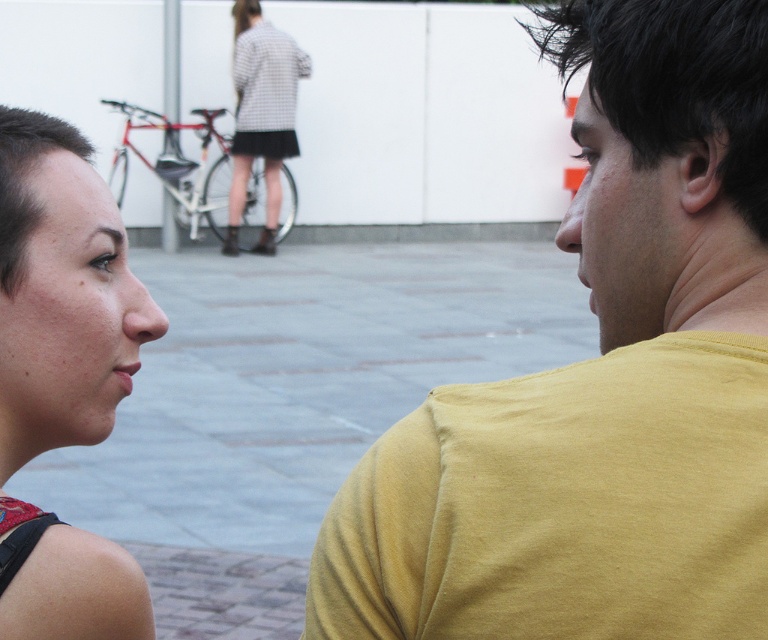
Which is more to the left, yellow cotton t-shirt at right or checkered fabric dress at upper center?

From the viewer's perspective, checkered fabric dress at upper center appears more on the left side.

Which is behind, point (608, 67) or point (263, 221)?

The point (263, 221) is behind.

Find the location of a particular element. This screenshot has height=640, width=768. yellow cotton t-shirt at right is located at coordinates (601, 380).

Is point (128, 598) positioned after point (303, 74)?

No, (128, 598) is in front of (303, 74).

Can you confirm if matte black hair at left is positioned below checkered fabric dress at upper center?

Correct, matte black hair at left is located below checkered fabric dress at upper center.

Measure the distance between matte black hair at left and camera.

matte black hair at left is 6.83 feet away from camera.

Where is `matte black hair at left`? The width and height of the screenshot is (768, 640). matte black hair at left is located at coordinates (61, 374).

Locate an element on the screen. The height and width of the screenshot is (640, 768). yellow cotton t-shirt at right is located at coordinates (601, 380).

Which is more to the right, yellow cotton t-shirt at right or matte black hair at left?

yellow cotton t-shirt at right is more to the right.

At what (x,y) coordinates should I click in order to perform the action: click on yellow cotton t-shirt at right. Please return your answer as a coordinate pair (x, y). Image resolution: width=768 pixels, height=640 pixels. Looking at the image, I should click on (601, 380).